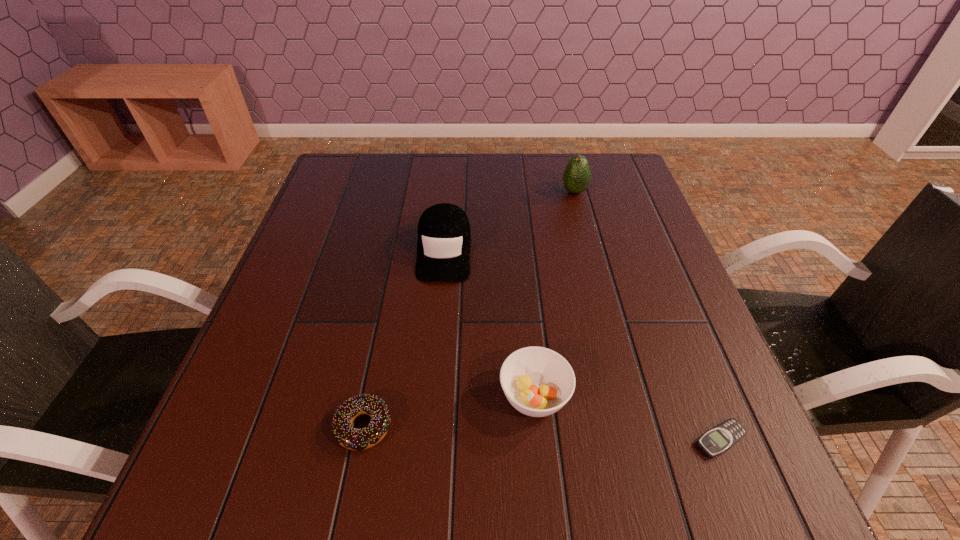
The width and height of the screenshot is (960, 540). What are the coordinates of `free spot at the far edge of the desktop` in the screenshot? It's located at (526, 171).

Image resolution: width=960 pixels, height=540 pixels. In the image, there is a desktop. In order to click on free space at the near edge in this screenshot , I will do `click(613, 507)`.

This screenshot has width=960, height=540. What are the coordinates of `vacant region at the left edge of the desktop` in the screenshot? It's located at (340, 315).

I want to click on free spot at the right edge of the desktop, so click(611, 248).

In order to click on free space at the far left corner in this screenshot , I will do `click(365, 179)`.

You are a GUI agent. You are given a task and a screenshot of the screen. Output one action in this format:
    pyautogui.click(x=<x>, y=<y>)
    Task: Click on the free space at the far right corner of the desktop
    The width and height of the screenshot is (960, 540).
    Given the screenshot: What is the action you would take?
    pyautogui.click(x=589, y=154)

Where is `vacant region at the near right corner of the desktop`? This screenshot has height=540, width=960. vacant region at the near right corner of the desktop is located at coordinates (754, 476).

Image resolution: width=960 pixels, height=540 pixels. Find the location of `empty location between the shortest object and the tallest object`. empty location between the shortest object and the tallest object is located at coordinates (648, 316).

Find the location of a particular element. The height and width of the screenshot is (540, 960). empty space that is in between the rightmost object and the third tallest object is located at coordinates (628, 418).

Locate an element on the screen. This screenshot has width=960, height=540. vacant space that's between the cap and the soup bowl is located at coordinates (490, 323).